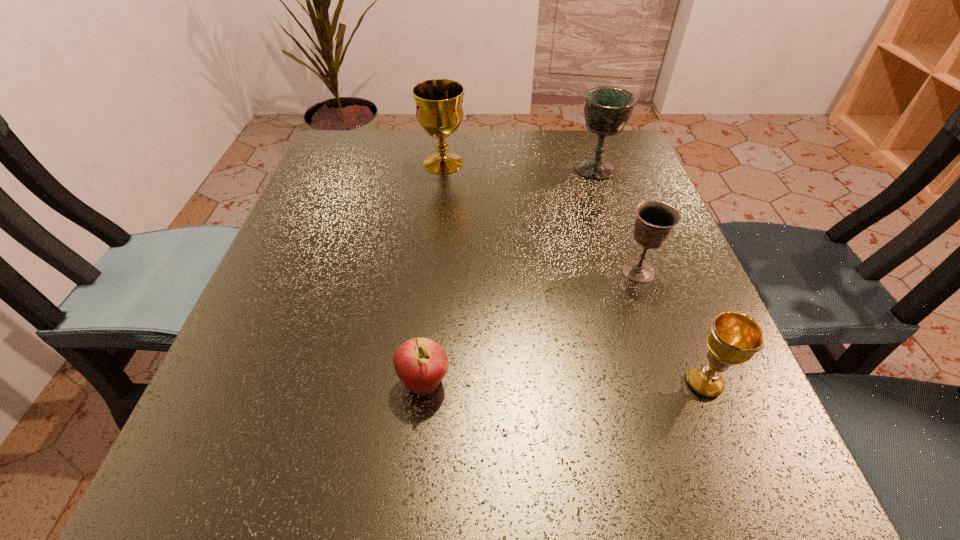
This screenshot has height=540, width=960. In order to click on the leftmost chalice in this screenshot , I will do `click(439, 111)`.

Find the location of a particular element. This screenshot has width=960, height=540. the third farthest object is located at coordinates (655, 221).

This screenshot has height=540, width=960. Find the location of `the nearest chalice`. the nearest chalice is located at coordinates (734, 338).

This screenshot has height=540, width=960. What are the coordinates of `apple` in the screenshot? It's located at (420, 363).

Where is `vacant space located 0.060m on the front of the leftmost chalice`? The width and height of the screenshot is (960, 540). vacant space located 0.060m on the front of the leftmost chalice is located at coordinates (440, 192).

Locate an element on the screen. vacant area situated 0.200m on the front of the third farthest object is located at coordinates (680, 390).

I want to click on free space located on the back of the nearest chalice, so click(636, 210).

Identify the location of free space located on the back of the apple. (438, 251).

Identify the location of object that is positioned at the far right corner. The height and width of the screenshot is (540, 960). (607, 110).

I want to click on free space at the far edge of the desktop, so click(568, 182).